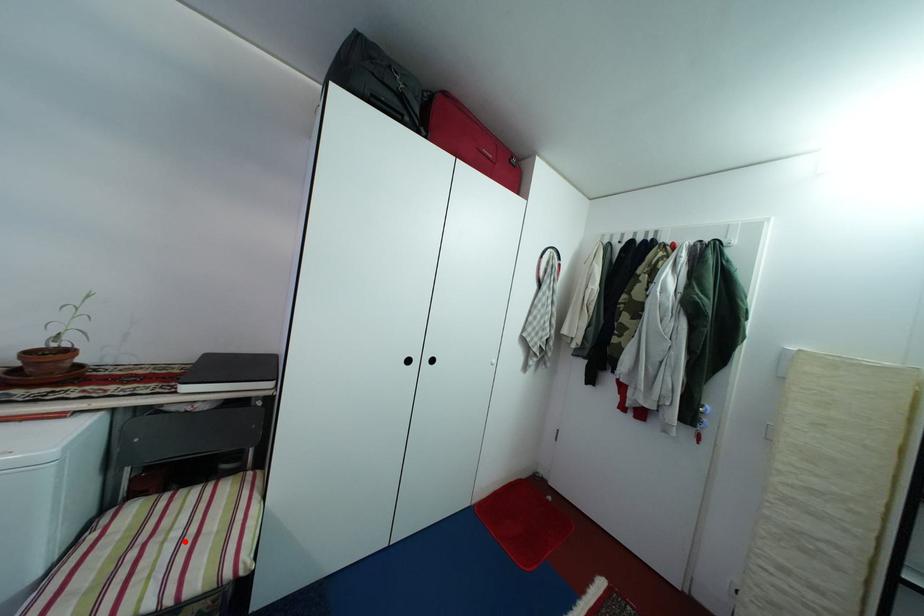
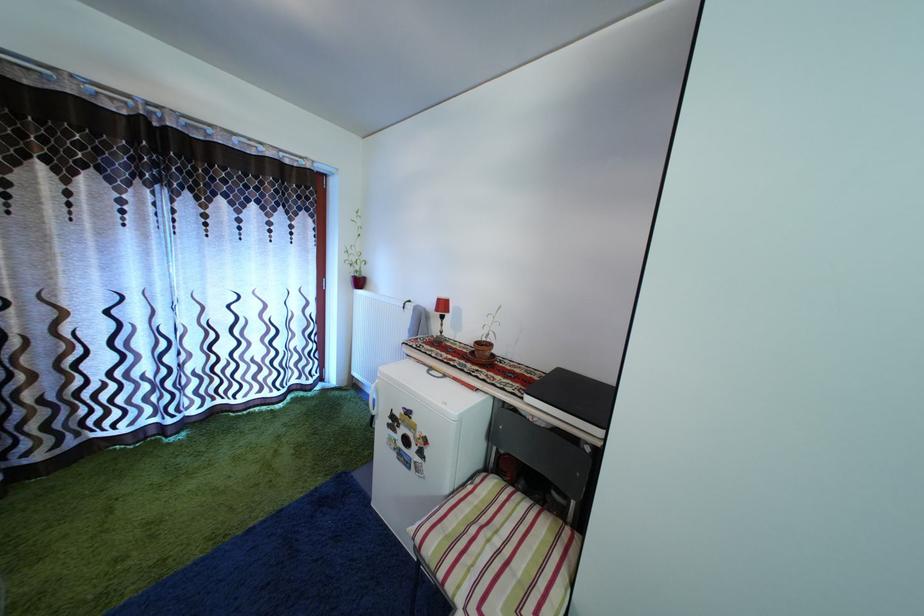
Locate, in the second image, the point that corresponds to the highlighted location in the first image.

(505, 549)